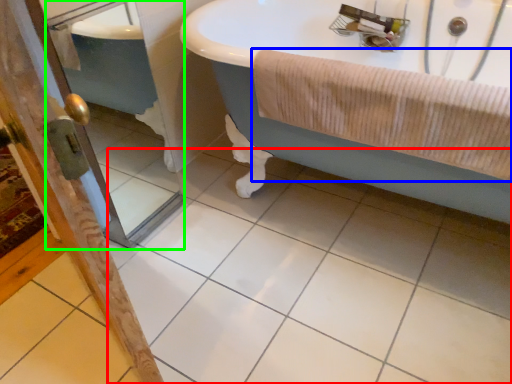
Question: Based on their relative distances, which object is farther from ceramic tile (highlighted by a red box)? Choose from bath towel (highlighted by a blue box) and screen door (highlighted by a green box).

Choices:
 (A) bath towel
 (B) screen door

Answer: (B)